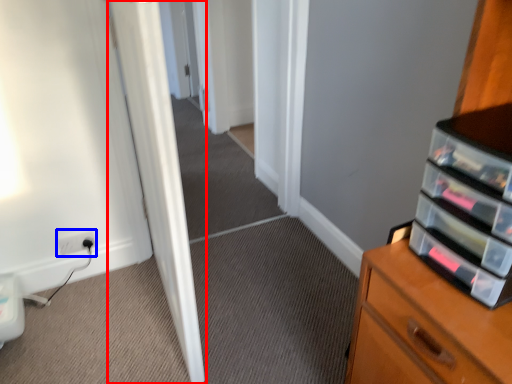
Question: Which object is further to the camera taking this photo, door (highlighted by a red box) or electric outlet (highlighted by a blue box)?

Choices:
 (A) door
 (B) electric outlet

Answer: (B)